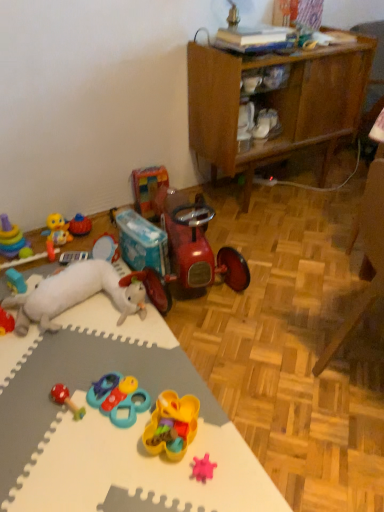
The image size is (384, 512). I want to click on free space behind rubberized red and green toy at lower left, the 6th toy positioned from the right, so click(80, 364).